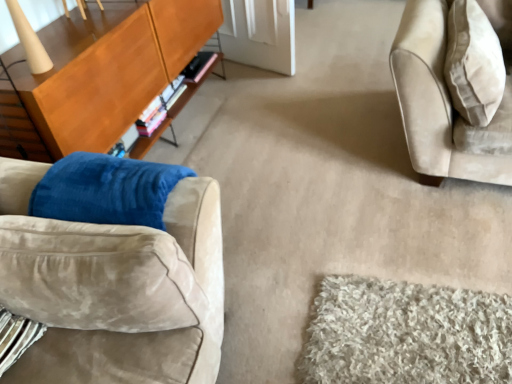
Question: Considering the positions of suede couch at left and beige fabric pillow at upper right in the image, is suede couch at left taller or shorter than beige fabric pillow at upper right?

Choices:
 (A) short
 (B) tall

Answer: (A)

Question: From the image's perspective, is suede couch at left located above or below beige fabric pillow at upper right?

Choices:
 (A) above
 (B) below

Answer: (B)

Question: Which is nearer to the wooden cabinet at left?

Choices:
 (A) suede couch at left
 (B) beige fabric pillow at upper right

Answer: (A)

Question: Estimate the real-world distances between objects in this image. Which object is closer to the beige fabric pillow at upper right?

Choices:
 (A) wooden cabinet at left
 (B) suede couch at left

Answer: (B)